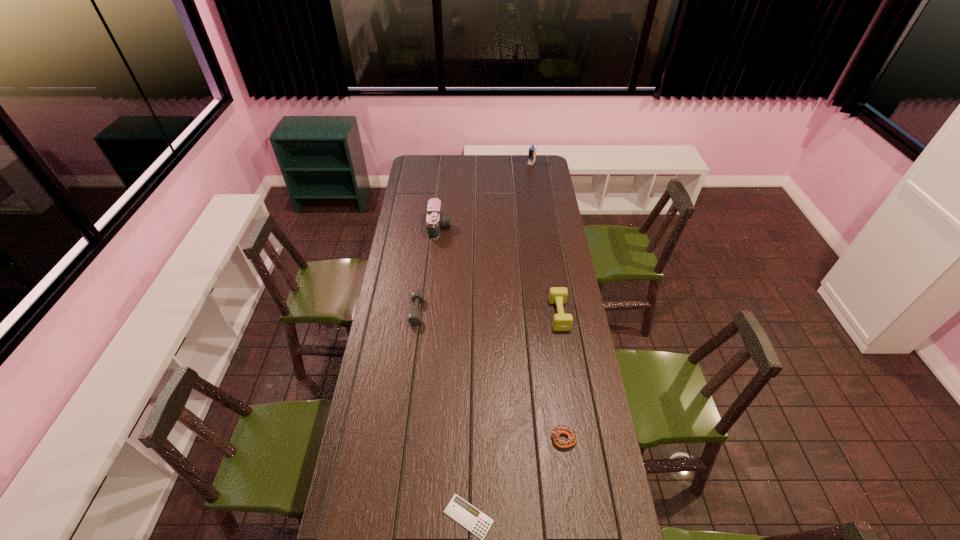
Image resolution: width=960 pixels, height=540 pixels. I want to click on camera, so click(435, 220).

Locate an element on the screen. orange_juice is located at coordinates (532, 150).

Identify the location of the third tallest object. (557, 295).

Locate an element on the screen. The image size is (960, 540). the right dumbbell is located at coordinates (557, 295).

Where is `the shorter dumbbell`? the shorter dumbbell is located at coordinates coord(414,317).

Where is `the left dumbbell`? This screenshot has height=540, width=960. the left dumbbell is located at coordinates (414, 317).

At what (x,y) coordinates should I click in order to perform the action: click on doughnut. Please return your answer as a coordinate pair (x, y). This screenshot has width=960, height=540. Looking at the image, I should click on (557, 430).

Image resolution: width=960 pixels, height=540 pixels. In order to click on the second nearest object in this screenshot , I will do `click(557, 430)`.

Where is `vacant space located 0.140m on the front-facing side of the camera`? This screenshot has width=960, height=540. vacant space located 0.140m on the front-facing side of the camera is located at coordinates (477, 227).

The image size is (960, 540). Find the location of `vacant region located 0.220m on the front of the orange_juice`. vacant region located 0.220m on the front of the orange_juice is located at coordinates (535, 185).